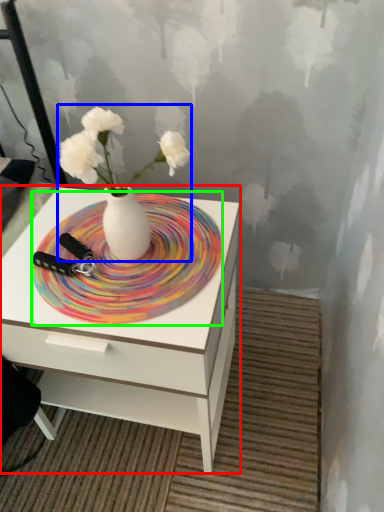
Question: Which object is positioned closest to nightstand (highlighted by a red box)? Select from floral arrangement (highlighted by a blue box) and plate (highlighted by a green box).

Choices:
 (A) floral arrangement
 (B) plate

Answer: (B)